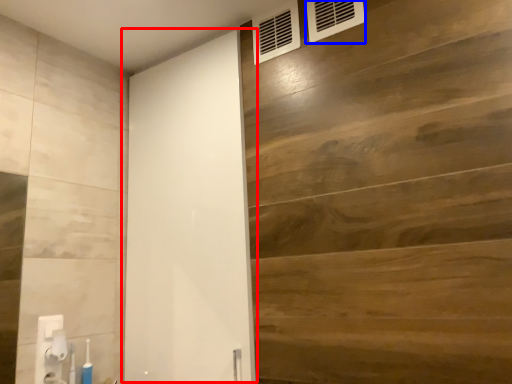
Question: Which object appears closest to the camera in this image, barn door (highlighted by a red box) or air conditioning (highlighted by a blue box)?

Choices:
 (A) barn door
 (B) air conditioning

Answer: (A)